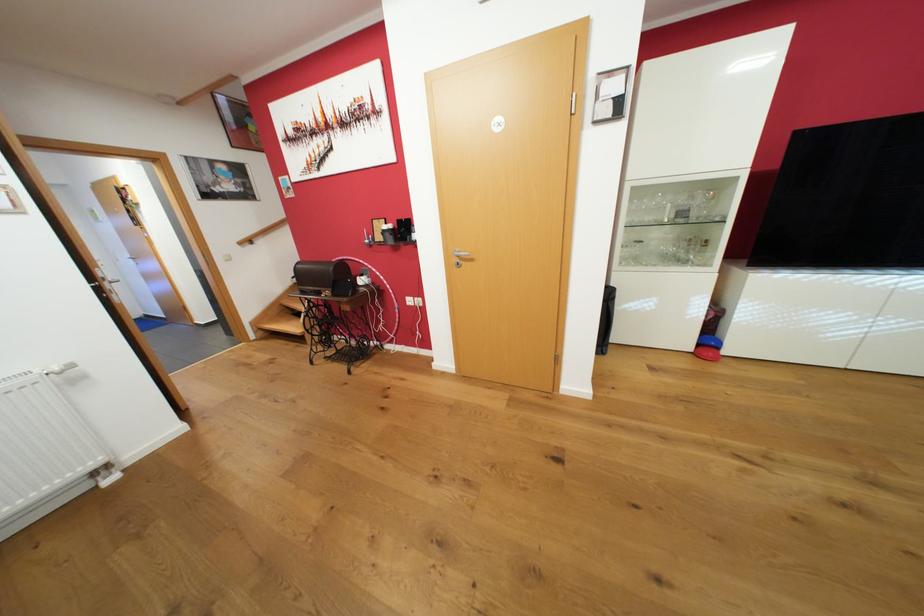
Image resolution: width=924 pixels, height=616 pixels. Identify the location of pink hula hoop. (380, 294).